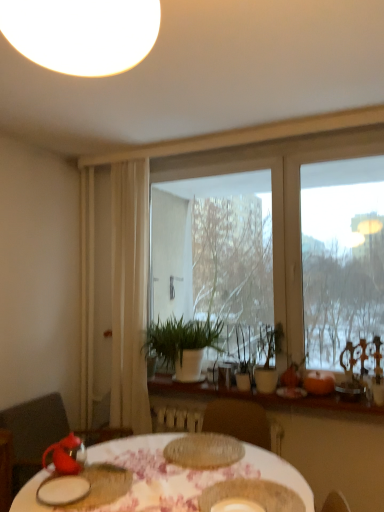
Where is `vacant space behind white ceramic plate at lower left, which ranks as the second tableware in left-to-right order`? vacant space behind white ceramic plate at lower left, which ranks as the second tableware in left-to-right order is located at coordinates (103, 470).